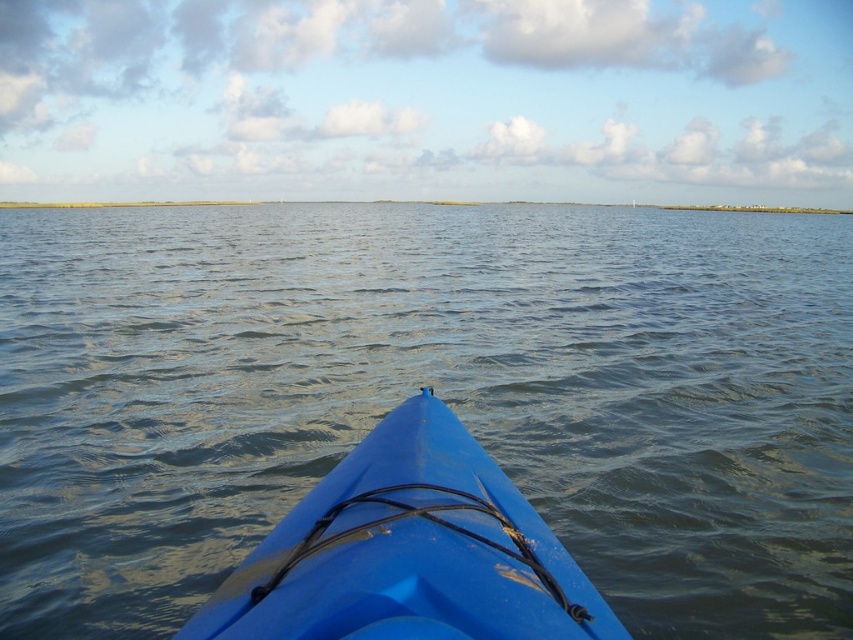
You are in a blue kayak at the bottom center of the image. You see a point marked at coordinates (434, 392). Based on the scene, where is this point located relative to the kayak?

The point marked at coordinates (434, 392) is located on the blue water at center, which is ahead of the kayak at bottom center.

Based on the photo, you are in a blue plastic kayak at center and want to know if you can stand up. Based on the scene, can you determine if the blue water at center is higher than the kayak?

The blue water at center is taller than blue plastic kayak at center, so yes, the water is higher than the kayak. However, standing up in a kayak may be dangerous due to the risk of capsizing, especially in moving water.